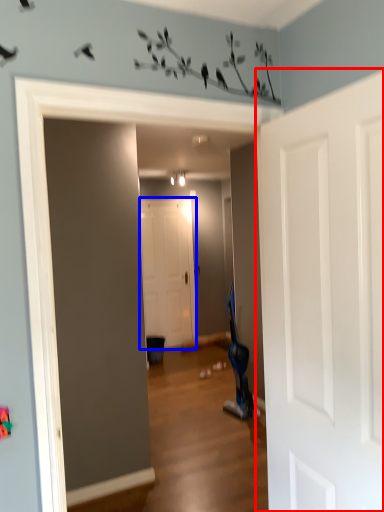
Question: Which object is closer to the camera taking this photo, door (highlighted by a red box) or door (highlighted by a blue box)?

Choices:
 (A) door
 (B) door

Answer: (A)